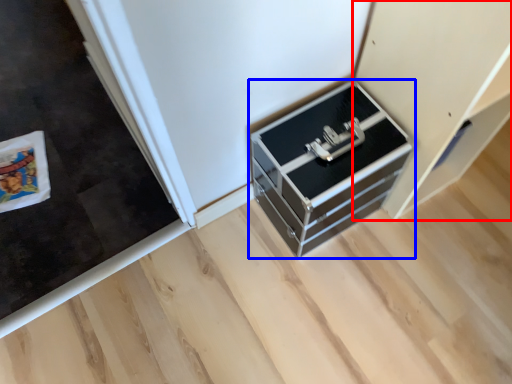
Question: Among these objects, which one is farthest to the camera, cabinetry (highlighted by a red box) or chest of drawers (highlighted by a blue box)?

Choices:
 (A) cabinetry
 (B) chest of drawers

Answer: (B)